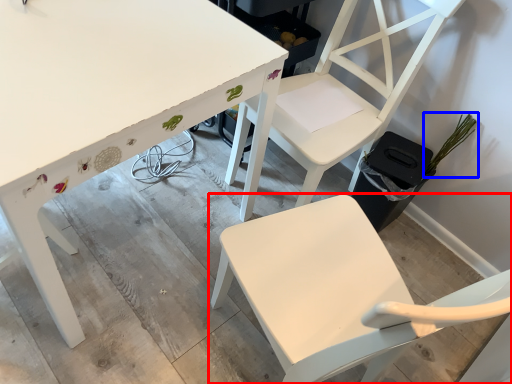
Question: Which object is further to the camera taking this photo, chair (highlighted by a red box) or plant (highlighted by a blue box)?

Choices:
 (A) chair
 (B) plant

Answer: (B)